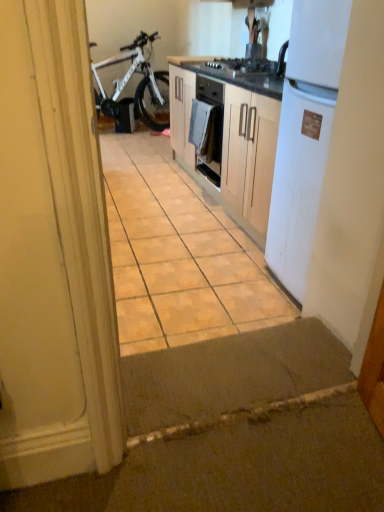
Question: Looking at their shapes, would you say brown matte tile at center is wider or thinner than white matte refrigerator at right?

Choices:
 (A) thin
 (B) wide

Answer: (B)

Question: Based on their sizes in the image, would you say brown matte tile at center is bigger or smaller than white matte refrigerator at right?

Choices:
 (A) big
 (B) small

Answer: (A)

Question: Estimate the real-world distances between objects in this image. Which object is farther from the white cloth at center?

Choices:
 (A) white matte bicycle at left
 (B) white matte refrigerator at right
 (C) brown matte tile at center

Answer: (A)

Question: Which object is positioned closest to the brown matte tile at center?

Choices:
 (A) white matte bicycle at left
 (B) white matte refrigerator at right
 (C) white cloth at center

Answer: (C)